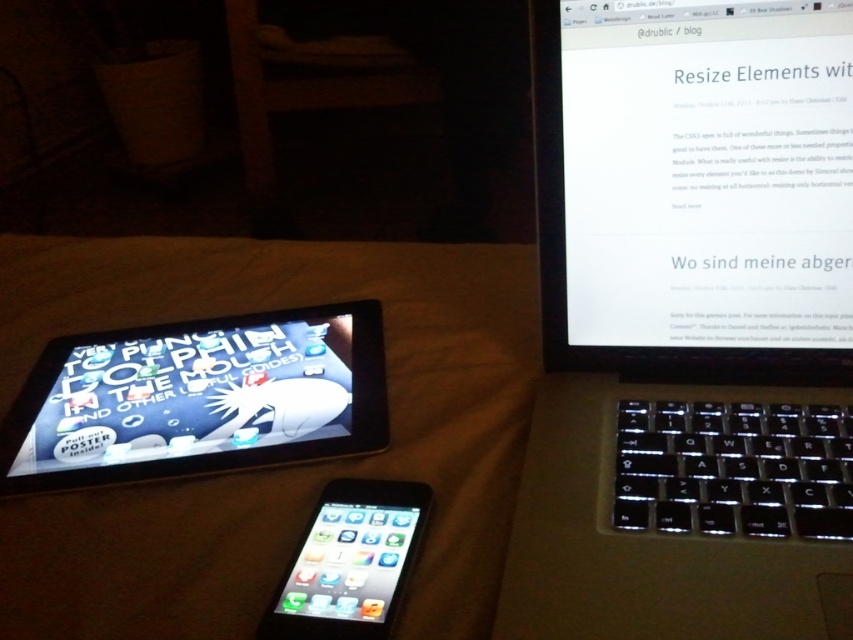
You are trying to reach the white glossy screen at upper center to turn it off, but there is a matte black tablet at lower left in the way. Can you move the tablet to access the screen?

The matte black tablet at lower left is behind the white glossy screen at upper center, so you can access the white glossy screen at upper center directly without needing to move the tablet.

You are standing in front of the three electronic devices on the bed or table. If you want to reach the point closer to you, which point should you choose between point (x=614, y=216) and point (x=267, y=340)?

Point (x=614, y=216) is closer to the camera than point (x=267, y=340), so you should choose point (x=614, y=216).

You are standing in front of the three electronic devices on the beige surface. Which of the two points, point (277, 340) or point (303, 625), is closer to you?

Point (277, 340) is closer to you than point (303, 625) because it is further to the viewer.